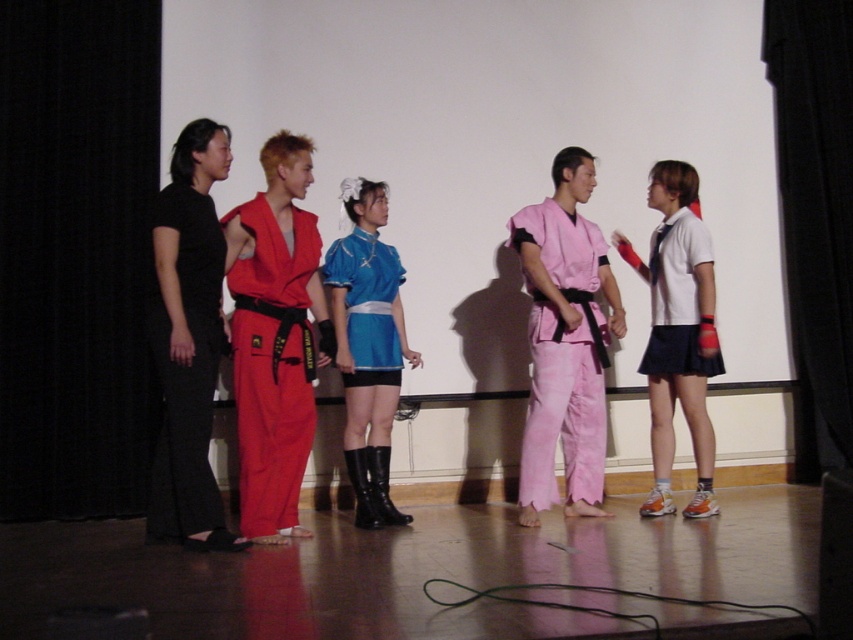
Question: Is blue satin dress at center to the left of shiny blue fabric dress at center from the viewer's perspective?

Choices:
 (A) no
 (B) yes

Answer: (B)

Question: Which point is closer to the camera?

Choices:
 (A) blue satin dress at center
 (B) shiny blue fabric dress at center
 (C) white matte shirt at center
 (D) matte red karate uniform at center

Answer: (D)

Question: Which object is the closest to the white matte shirt at center?

Choices:
 (A) blue satin dress at center
 (B) matte red karate uniform at center

Answer: (A)

Question: Is pink cotton karate uniform at center positioned in front of blue satin dress at center?

Choices:
 (A) no
 (B) yes

Answer: (B)

Question: Considering the real-world distances, which object is closest to the blue satin dress at center?

Choices:
 (A) black matte pants at left
 (B) shiny blue fabric dress at center
 (C) pink cotton karate uniform at center
 (D) matte red karate uniform at center

Answer: (B)

Question: Considering the relative positions of white matte shirt at center and shiny blue fabric dress at center in the image provided, where is white matte shirt at center located with respect to shiny blue fabric dress at center?

Choices:
 (A) right
 (B) left

Answer: (A)